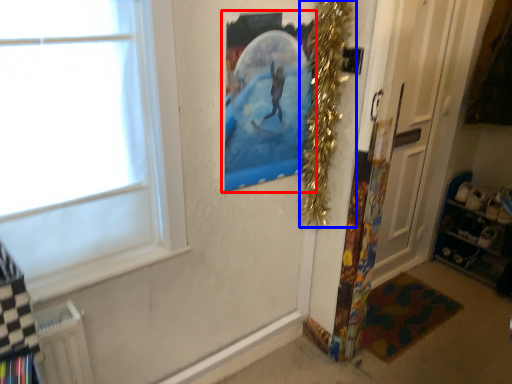
Question: Which of the following is the closest to the observer, picture frame (highlighted by a red box) or christmas decoration (highlighted by a blue box)?

Choices:
 (A) picture frame
 (B) christmas decoration

Answer: (A)